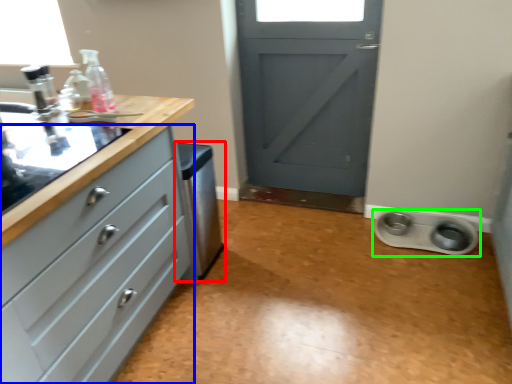
Question: Considering the real-world distances, which object is closest to dish washer (highlighted by a red box)? chest of drawers (highlighted by a blue box) or appliance (highlighted by a green box).

Choices:
 (A) chest of drawers
 (B) appliance

Answer: (A)